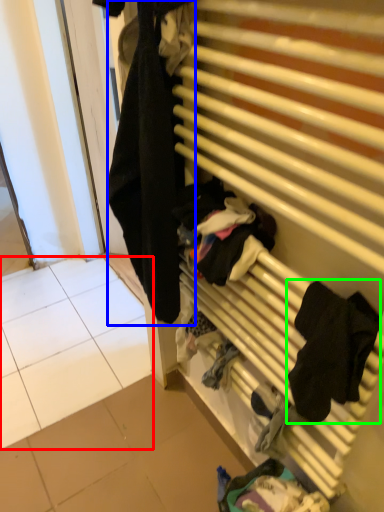
Question: Based on their relative distances, which object is farther from tile (highlighted by a red box)? Choose from clothing (highlighted by a blue box) and clothing (highlighted by a green box).

Choices:
 (A) clothing
 (B) clothing

Answer: (B)